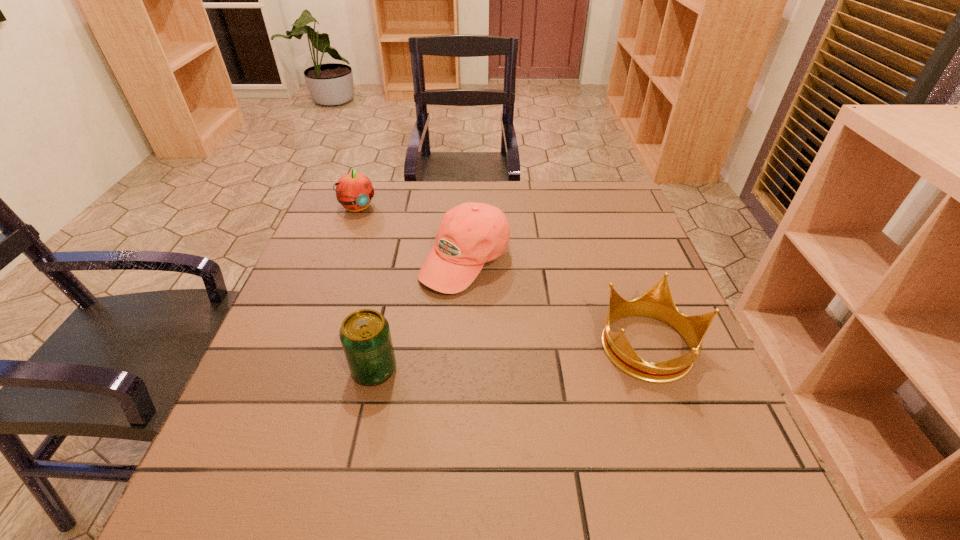
At what (x,y) coordinates should I click in order to perform the action: click on vacant space situated on the surface of the farthest object. Please return your answer as a coordinate pair (x, y). The image size is (960, 540). Looking at the image, I should click on (440, 295).

Find the location of a particular element. The height and width of the screenshot is (540, 960). free location located 0.200m on the front-facing side of the baseball cap is located at coordinates (522, 359).

This screenshot has width=960, height=540. In order to click on free space located on the front-facing side of the baseball cap in this screenshot , I will do `click(519, 355)`.

You are a GUI agent. You are given a task and a screenshot of the screen. Output one action in this format:
    pyautogui.click(x=<x>, y=<y>)
    Task: Click on the free spot located on the front-facing side of the baseball cap
    
    Given the screenshot: What is the action you would take?
    pyautogui.click(x=519, y=355)

Identify the location of object situated at the far edge. (354, 191).

This screenshot has width=960, height=540. What are the coordinates of `object that is positioned at the left edge` in the screenshot? It's located at (354, 191).

At what (x,y) coordinates should I click in order to perform the action: click on object positioned at the right edge. Please return your answer as a coordinate pair (x, y). Image resolution: width=960 pixels, height=540 pixels. Looking at the image, I should click on (657, 302).

The height and width of the screenshot is (540, 960). What are the coordinates of `object that is at the far left corner` in the screenshot? It's located at (354, 191).

In order to click on free space at the far edge in this screenshot , I will do `click(386, 211)`.

This screenshot has width=960, height=540. In order to click on free region at the left edge in this screenshot , I will do `click(263, 376)`.